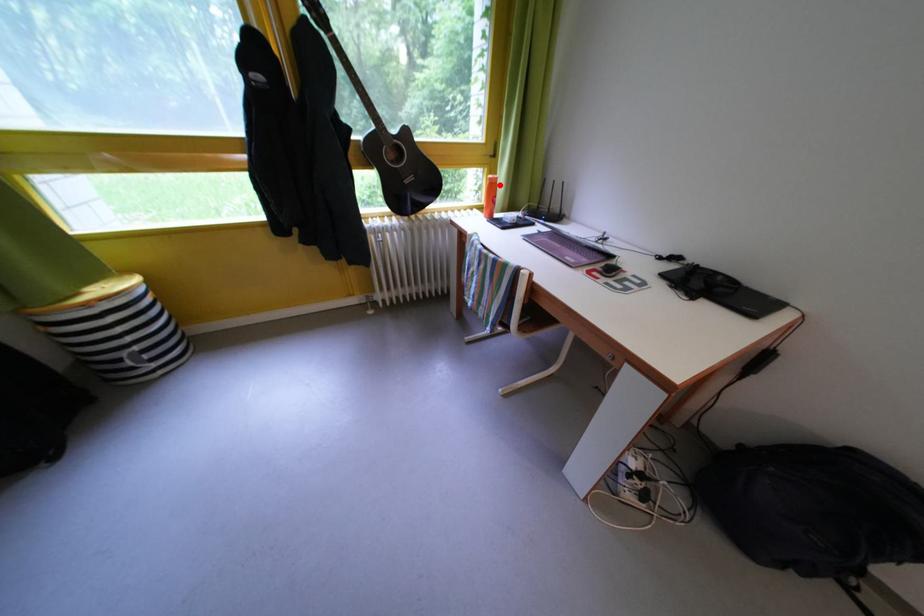
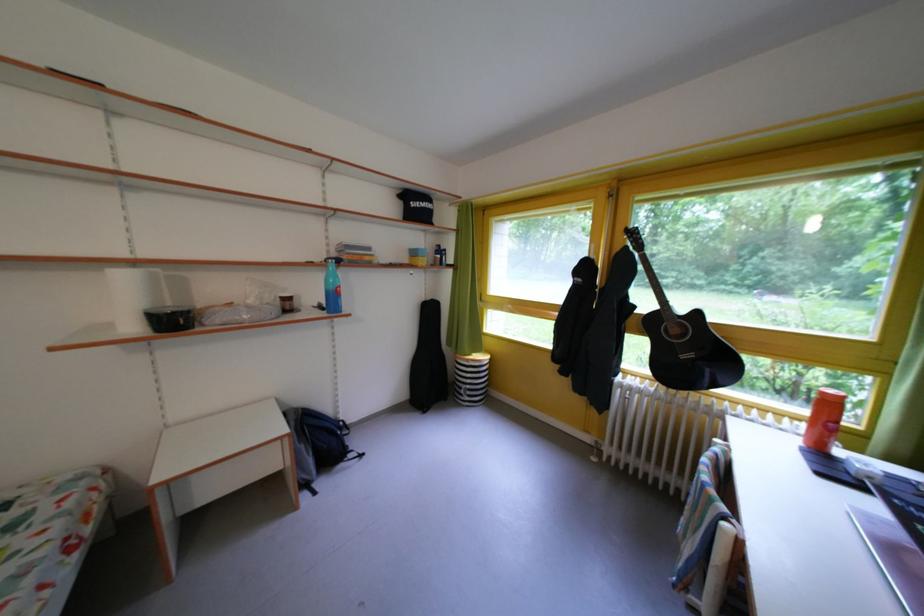
Question: I am providing you with two images of the same scene from different viewpoints. A red point is marked on the first image. At the location where the point appears in image 1, is it still visible in image 2?

Choices:
 (A) Yes
 (B) No

Answer: (A)